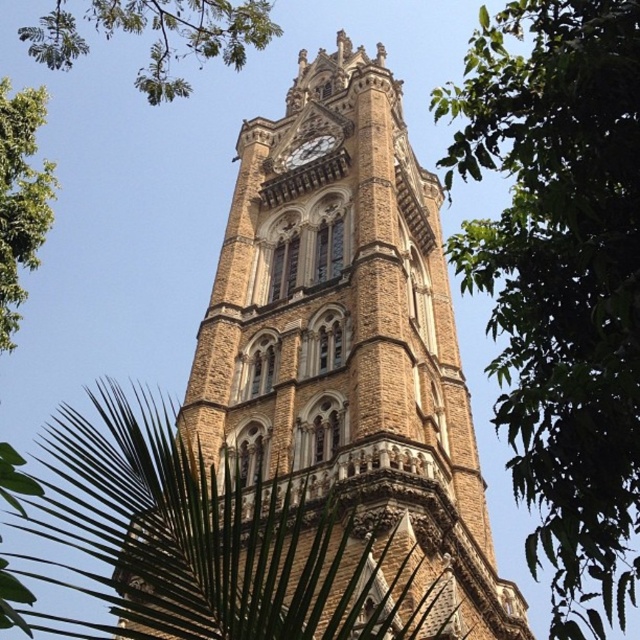
Question: Among these objects, which one is farthest from the camera?

Choices:
 (A) green leafy tree at upper left
 (B) brown stone clock tower at center
 (C) green leafy tree at left
 (D) green leafy tree at right

Answer: (A)

Question: Which point appears farthest from the camera in this image?

Choices:
 (A) (166, 77)
 (B) (253, 205)
 (C) (552, 550)
 (D) (326, 134)

Answer: (A)

Question: From the image, what is the correct spatial relationship of green leafy tree at right in relation to green leafy tree at upper left?

Choices:
 (A) left
 (B) right

Answer: (B)

Question: Can you confirm if brown stone clock tower at center is wider than green leafy tree at left?

Choices:
 (A) no
 (B) yes

Answer: (A)

Question: In this image, where is brown stone clock tower at center located relative to gold textured clock at center?

Choices:
 (A) left
 (B) right

Answer: (B)

Question: Which point is farther to the camera?

Choices:
 (A) (320, 156)
 (B) (266, 173)

Answer: (B)